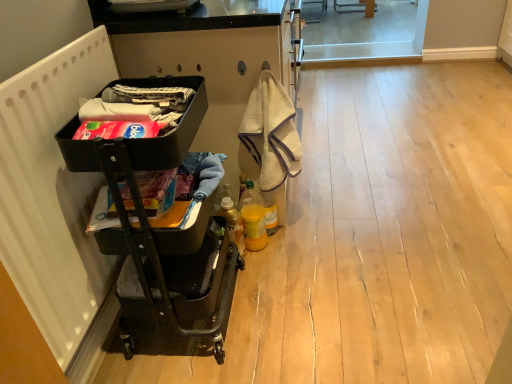
Identify the location of free spot to the right of translucent plastic bottle at center, the 1th bottle from the right. This screenshot has height=384, width=512. (320, 229).